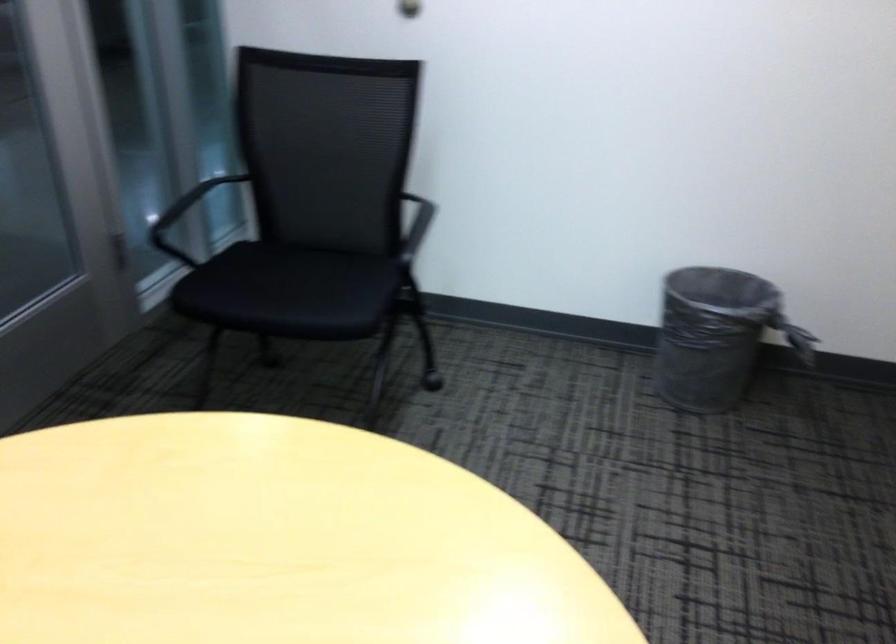
Find the location of a particular element. chair sitting surface is located at coordinates (290, 275).